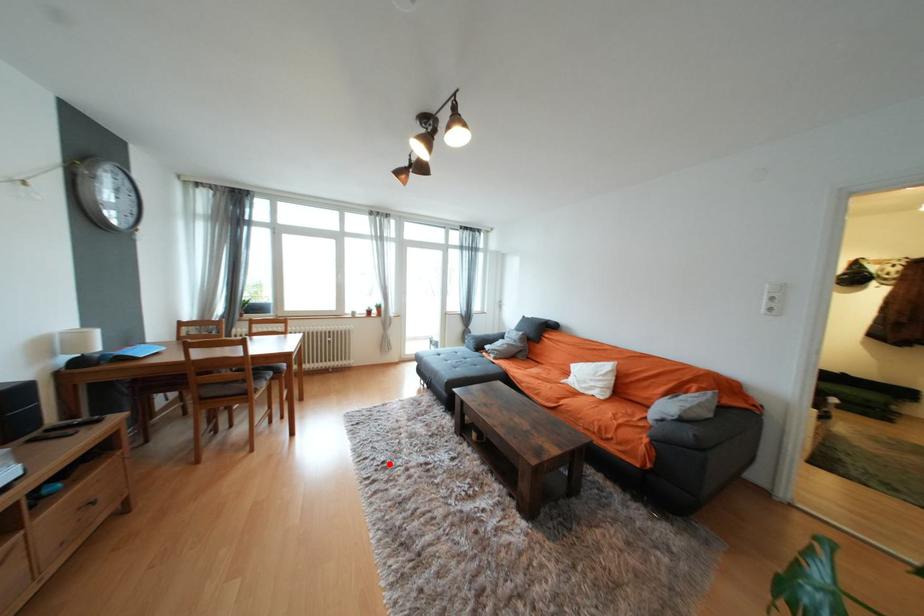
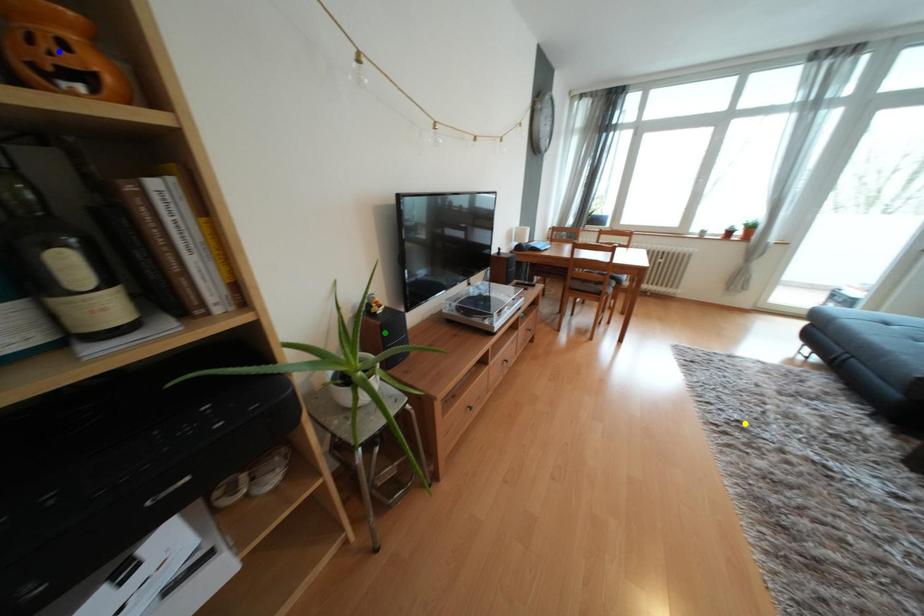
Question: I am providing you with two images of the same scene from different viewpoints. A red point is marked on the first image. You are given multiple points on the second image. Which point in image 2 is actually the same real-world point as the red point in image 1?

Choices:
 (A) yellow point
 (B) blue point
 (C) green point

Answer: (A)